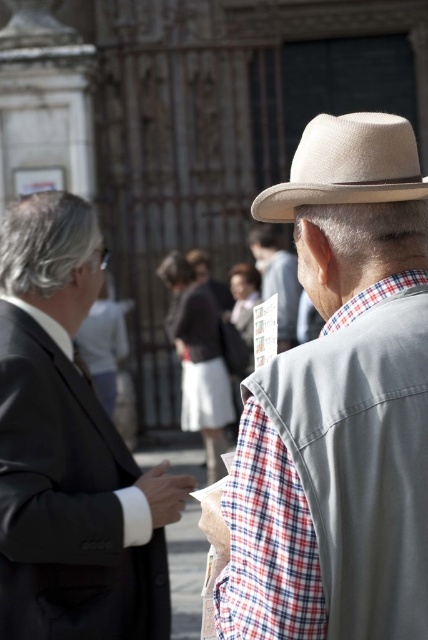
Question: In this image, where is matte black suit at left located relative to light beige felt fedora at center?

Choices:
 (A) left
 (B) right

Answer: (A)

Question: Does beige straw hat at upper right appear under plaid fabric shirt at center?

Choices:
 (A) yes
 (B) no

Answer: (A)

Question: Does matte black suit at left lie behind plaid fabric shirt at center?

Choices:
 (A) yes
 (B) no

Answer: (B)

Question: Among these points, which one is farthest from the camera?

Choices:
 (A) (401, 177)
 (B) (386, 528)

Answer: (A)

Question: Estimate the real-world distances between objects in this image. Which object is farther from the plaid fabric shirt at center?

Choices:
 (A) matte black suit at left
 (B) light beige felt fedora at center
 (C) beige straw hat at upper right

Answer: (C)

Question: Estimate the real-world distances between objects in this image. Which object is farther from the beige straw hat at upper right?

Choices:
 (A) plaid fabric shirt at center
 (B) light beige felt fedora at center
 (C) matte black suit at left

Answer: (A)